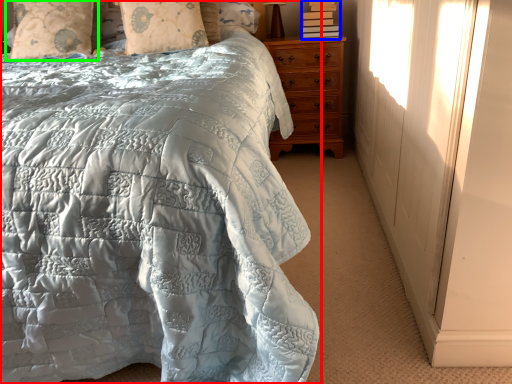
Question: Which object is the farthest from bed (highlighted by a red box)? Choose among these: book (highlighted by a blue box) or pillow (highlighted by a green box).

Choices:
 (A) book
 (B) pillow

Answer: (A)